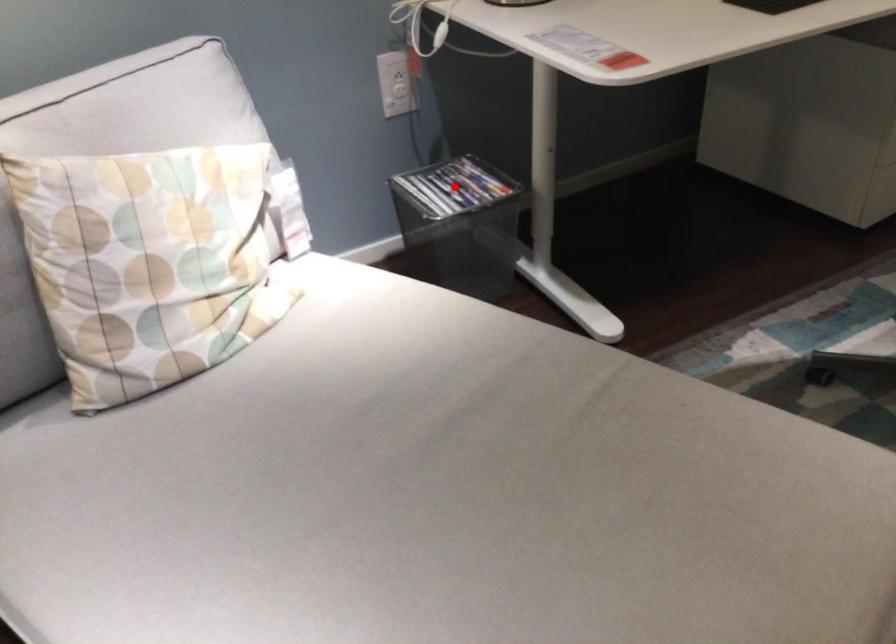
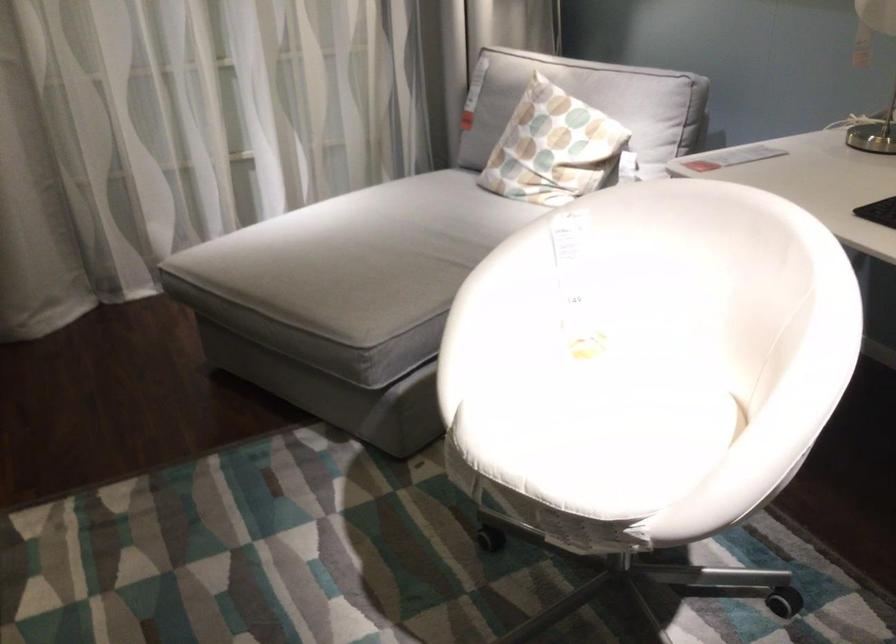
Question: I am providing you with two images of the same scene from different viewpoints. A red point is marked on the first image. At the location where the point appears in image 1, is it still visible in image 2?

Choices:
 (A) Yes
 (B) No

Answer: (B)